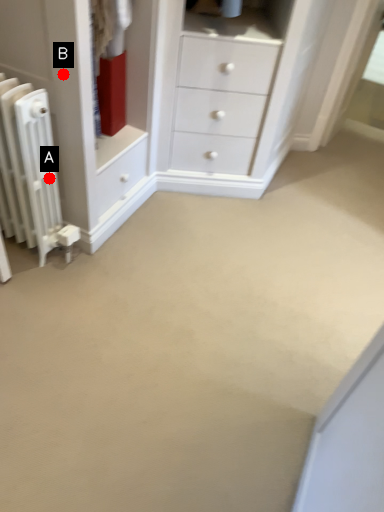
Question: Two points are circled on the image, labeled by A and B beside each circle. Which point is farther to the camera?

Choices:
 (A) A is further
 (B) B is further

Answer: (A)